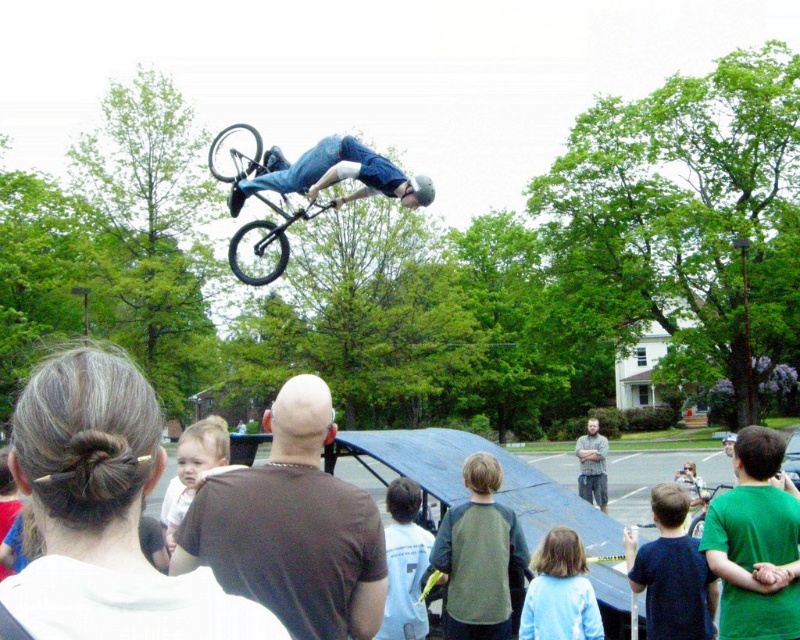
Is white hair bun at upper left thinner than dark blue shirt at lower right?

No.

Is point (252, 604) positioned before point (704, 636)?

Yes, it is.

Is point (92, 502) positioned in front of point (692, 609)?

Yes, point (92, 502) is closer to viewer.

The width and height of the screenshot is (800, 640). Find the location of `white hair bun at upper left`. white hair bun at upper left is located at coordinates [104, 513].

Who is higher up, green raglan shirt at center or light blue jersey at center?

green raglan shirt at center is above.

Can you confirm if green raglan shirt at center is positioned to the right of light blue jersey at center?

Indeed, green raglan shirt at center is positioned on the right side of light blue jersey at center.

What are the coordinates of `green raglan shirt at center` in the screenshot? It's located at (480, 556).

Can you confirm if light blue jersey at center is positioned below shiny metallic bicycle at center?

No.

Who is higher up, light blue jersey at center or shiny metallic bicycle at center?

Positioned higher is light blue jersey at center.

Identify the location of light blue jersey at center. The image size is (800, 640). (404, 563).